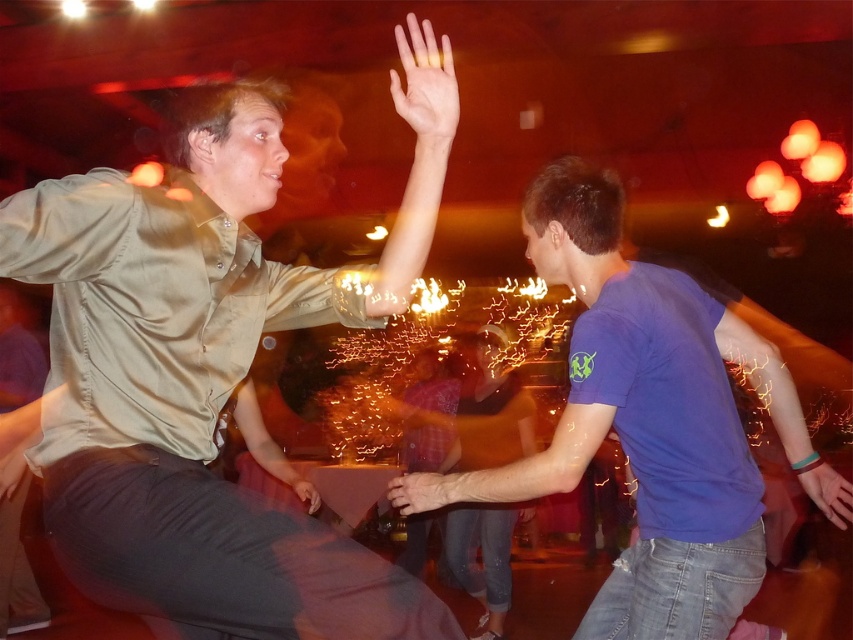
This screenshot has height=640, width=853. What do you see at coordinates (648, 422) in the screenshot? I see `blue cotton t-shirt at right` at bounding box center [648, 422].

Is blue cotton t-shirt at right closer to the viewer compared to blue cotton shirt at center?

Yes, blue cotton t-shirt at right is in front of blue cotton shirt at center.

Which is behind, point (653, 429) or point (460, 522)?

Point (460, 522)

At what (x,y) coordinates should I click in order to perform the action: click on blue cotton t-shirt at right. Please return your answer as a coordinate pair (x, y). The height and width of the screenshot is (640, 853). Looking at the image, I should click on [648, 422].

Based on the photo, does matte khaki shirt at upper left have a greater width compared to blue cotton t-shirt at right?

Incorrect, matte khaki shirt at upper left's width does not surpass blue cotton t-shirt at right's.

Describe the element at coordinates (207, 371) in the screenshot. This screenshot has height=640, width=853. I see `matte khaki shirt at upper left` at that location.

Which is behind, point (119, 381) or point (648, 298)?

The point (648, 298) is more distant.

What are the coordinates of `matte khaki shirt at upper left` in the screenshot? It's located at (207, 371).

Can you confirm if matte khaki shirt at upper left is positioned below blue cotton shirt at center?

No.

Where is `matte khaki shirt at upper left`? matte khaki shirt at upper left is located at coordinates (207, 371).